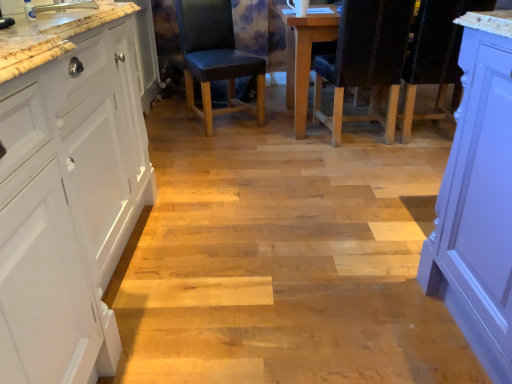
From the picture: Measure the distance between point (54,225) and camera.

A distance of 34.21 inches exists between point (54,225) and camera.

Locate an element on the screen. Image resolution: width=512 pixels, height=384 pixels. leather-like black chair at center, which is the second chair in right-to-left order is located at coordinates (216, 58).

Identify the location of black leather chair at center, positioned as the second chair in left-to-right order. This screenshot has height=384, width=512. (365, 61).

Between black leather chair at center, positioned as the second chair in left-to-right order, and white matte cabinet at left, which one appears on the left side from the viewer's perspective?

white matte cabinet at left is more to the left.

Identify the location of cabinetry that is below the black leather chair at center, arranged as the first chair when viewed from the right (from the image's perspective). The image size is (512, 384). [x=68, y=191].

Can you confirm if black leather chair at center, arranged as the first chair when viewed from the right, is bigger than white matte cabinet at left?

No.

From a real-world perspective, which object rests below the other?

black leather chair at center, arranged as the first chair when viewed from the right, is physically lower.

At what (x,y) coordinates should I click in order to perform the action: click on cabinetry below the leather-like black chair at center, arranged as the 1th chair when viewed from the left (from the image's perspective). Please return your answer as a coordinate pair (x, y). Looking at the image, I should click on (68, 191).

In the scene shown: Is white matte cabinet at left facing towards leather-like black chair at center, which is the second chair in right-to-left order?

No.

Between white matte cabinet at left and leather-like black chair at center, which is the second chair in right-to-left order, which one appears on the left side from the viewer's perspective?

Positioned to the left is white matte cabinet at left.

Is white matte cabinet at left directly adjacent to leather-like black chair at center, which is the second chair in right-to-left order?

They are not placed beside each other.

Between leather-like black chair at center, which is the second chair in right-to-left order, and black leather chair at center, positioned as the second chair in left-to-right order, which one has larger width?

black leather chair at center, positioned as the second chair in left-to-right order, is wider.

Considering the positions of point (208, 128) and point (364, 54), is point (208, 128) closer or farther from the camera than point (364, 54)?

Point (208, 128) is farther from the camera than point (364, 54).

From a real-world perspective, who is located lower, leather-like black chair at center, which is the second chair in right-to-left order, or black leather chair at center, positioned as the second chair in left-to-right order?

leather-like black chair at center, which is the second chair in right-to-left order, from a real-world perspective.

Are leather-like black chair at center, arranged as the 1th chair when viewed from the left, and black leather chair at center, positioned as the second chair in left-to-right order, making contact?

leather-like black chair at center, arranged as the 1th chair when viewed from the left, and black leather chair at center, positioned as the second chair in left-to-right order, are clearly separated.

Is white matte cabinet at left looking in the opposite direction of black leather chair at center, positioned as the second chair in left-to-right order?

No, black leather chair at center, positioned as the second chair in left-to-right order, is not at the back of white matte cabinet at left.

Between white matte cabinet at left and black leather chair at center, arranged as the first chair when viewed from the right, which one appears on the left side from the viewer's perspective?

From the viewer's perspective, white matte cabinet at left appears more on the left side.

Is white matte cabinet at left behind black leather chair at center, arranged as the first chair when viewed from the right?

No, it is in front of black leather chair at center, arranged as the first chair when viewed from the right.

From the image's perspective, between white matte cabinet at left and black leather chair at center, positioned as the second chair in left-to-right order, who is located below?

white matte cabinet at left.

Is point (204, 53) closer or farther from the camera than point (28, 289)?

Point (204, 53) is farther from the camera than point (28, 289).

What's the angular difference between leather-like black chair at center, arranged as the 1th chair when viewed from the left, and white matte cabinet at left's facing directions?

There is a 64.2-degree angle between the facing directions of leather-like black chair at center, arranged as the 1th chair when viewed from the left, and white matte cabinet at left.

Is leather-like black chair at center, which is the second chair in right-to-left order, at the left side of white matte cabinet at left?

No, leather-like black chair at center, which is the second chair in right-to-left order, is not to the left of white matte cabinet at left.

In terms of width, does black leather chair at center, arranged as the first chair when viewed from the right, look wider or thinner when compared to leather-like black chair at center, which is the second chair in right-to-left order?

Clearly, black leather chair at center, arranged as the first chair when viewed from the right, has more width compared to leather-like black chair at center, which is the second chair in right-to-left order.

Based on the photo, is black leather chair at center, arranged as the first chair when viewed from the right, to the right of leather-like black chair at center, which is the second chair in right-to-left order, from the viewer's perspective?

Yes.

Is black leather chair at center, arranged as the first chair when viewed from the right, in front of leather-like black chair at center, arranged as the 1th chair when viewed from the left?

Yes, the depth of black leather chair at center, arranged as the first chair when viewed from the right, is less than that of leather-like black chair at center, arranged as the 1th chair when viewed from the left.

Where is `cabinetry below the black leather chair at center, arranged as the first chair when viewed from the right (from the image's perspective)`? The width and height of the screenshot is (512, 384). cabinetry below the black leather chair at center, arranged as the first chair when viewed from the right (from the image's perspective) is located at coordinates (68, 191).

In order to click on cabinetry on the left of leather-like black chair at center, arranged as the 1th chair when viewed from the left in this screenshot , I will do `click(68, 191)`.

From the image, which object appears to be farther from leather-like black chair at center, which is the second chair in right-to-left order, black leather chair at center, arranged as the first chair when viewed from the right, or white matte cabinet at left?

Among the two, white matte cabinet at left is located further to leather-like black chair at center, which is the second chair in right-to-left order.

Estimate the real-world distances between objects in this image. Which object is closer to black leather chair at center, arranged as the first chair when viewed from the right, leather-like black chair at center, arranged as the 1th chair when viewed from the left, or white matte cabinet at left?

leather-like black chair at center, arranged as the 1th chair when viewed from the left, is closer to black leather chair at center, arranged as the first chair when viewed from the right.

When comparing their distances from black leather chair at center, positioned as the second chair in left-to-right order, does white matte cabinet at left or leather-like black chair at center, arranged as the 1th chair when viewed from the left, seem further?

white matte cabinet at left is positioned further to the anchor black leather chair at center, positioned as the second chair in left-to-right order.

When comparing their distances from white matte cabinet at left, does leather-like black chair at center, arranged as the 1th chair when viewed from the left, or black leather chair at center, arranged as the first chair when viewed from the right, seem further?

black leather chair at center, arranged as the first chair when viewed from the right, is positioned further to the anchor white matte cabinet at left.

Based on their spatial positions, is black leather chair at center, positioned as the second chair in left-to-right order, or leather-like black chair at center, which is the second chair in right-to-left order, further from white matte cabinet at left?

The object further to white matte cabinet at left is black leather chair at center, positioned as the second chair in left-to-right order.

Based on their spatial positions, is white matte cabinet at left or black leather chair at center, positioned as the second chair in left-to-right order, closer to leather-like black chair at center, arranged as the 1th chair when viewed from the left?

black leather chair at center, positioned as the second chair in left-to-right order, is positioned closer to the anchor leather-like black chair at center, arranged as the 1th chair when viewed from the left.

Find the location of `chair between white matte cabinet at left and leather-like black chair at center, arranged as the 1th chair when viewed from the left, from front to back`. chair between white matte cabinet at left and leather-like black chair at center, arranged as the 1th chair when viewed from the left, from front to back is located at coordinates (365, 61).